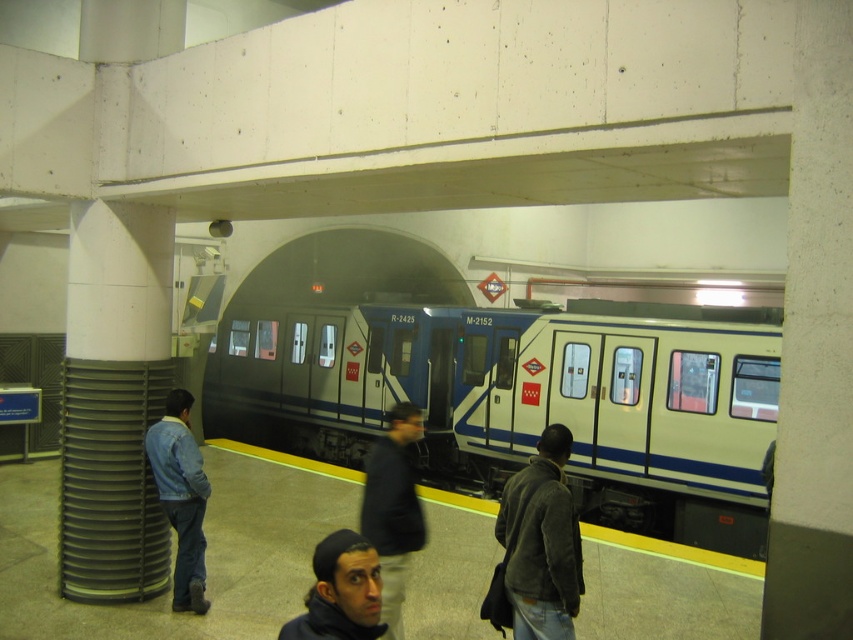
Measure the distance from denim jacket at left to dark blue knit cap at lower center.

3.44 meters

Which is above, denim jacket at left or dark blue knit cap at lower center?

dark blue knit cap at lower center

Measure the distance between denim jacket at left and camera.

The distance of denim jacket at left from camera is 18.38 feet.

At what (x,y) coordinates should I click in order to perform the action: click on denim jacket at left. Please return your answer as a coordinate pair (x, y). Looking at the image, I should click on (181, 497).

Is point (537, 515) farther from viewer compared to point (204, 604)?

No.

Which is in front, point (560, 468) or point (172, 484)?

Point (560, 468) is in front.

Find the location of a particular element. dark brown fuzzy jacket at center is located at coordinates (541, 541).

From the picture: Is white glossy train at center to the left of dark brown fuzzy jacket at center from the viewer's perspective?

Indeed, white glossy train at center is positioned on the left side of dark brown fuzzy jacket at center.

Who is positioned more to the right, white glossy train at center or dark brown fuzzy jacket at center?

dark brown fuzzy jacket at center is more to the right.

Is point (706, 369) behind point (575, 579)?

Yes, point (706, 369) is behind point (575, 579).

Find the location of `white glossy train at center`. white glossy train at center is located at coordinates (527, 401).